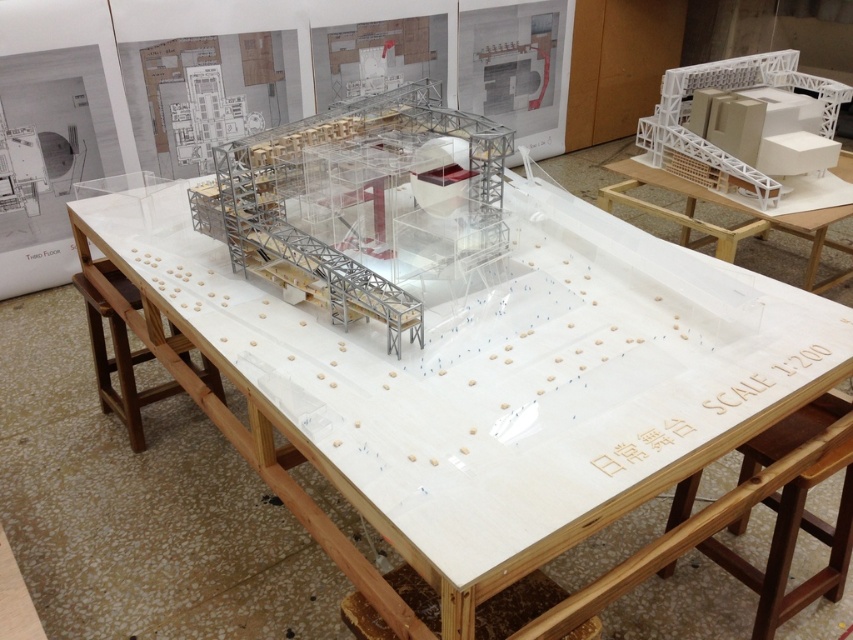
You are an architect examining the model of the building. You need to place a small scale model of a car next to the white wood table at center and the white matte table at upper right. Which table should you place it on if you want it to be closer to the main architectural model?

You should place the car model next to the white wood table at center because it is positioned to the left of the white matte table at upper right, making it closer to the main architectural model displayed on the white wood table at center.

You are an architect examining the model on the white wood table at center and the white matte table at upper right. Which table is located below the other?

The white wood table at center is positioned under the white matte table at upper right, so the white wood table at center is below the white matte table at upper right.

You are an architect standing in front of the model and need to move the brown wood stool at lower right to make space. Which direction should you move it so it doesn not block the white matte table at upper right?

The brown wood stool at lower right is currently in front of the white matte table at upper right. To avoid blocking it, move the stool away from the direction of the white matte table at upper right.